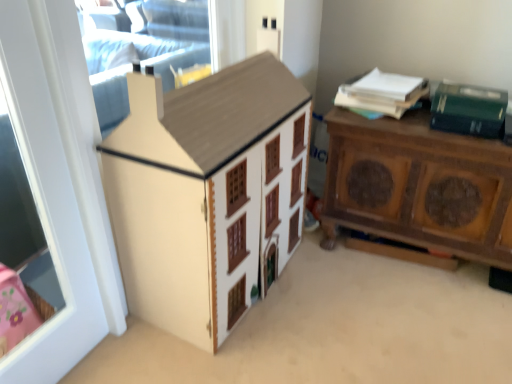
Find the location of a particular element. green matte box at upper right is located at coordinates (468, 110).

You are a GUI agent. You are given a task and a screenshot of the screen. Output one action in this format:
    pyautogui.click(x=<x>, y=<y>)
    Task: Click on the brown wood nightstand at right
    The width and height of the screenshot is (512, 384).
    Given the screenshot: What is the action you would take?
    pyautogui.click(x=419, y=186)

Describe the element at coordinates (207, 193) in the screenshot. The image size is (512, 384). I see `matte wood cabinet at center` at that location.

The height and width of the screenshot is (384, 512). In order to click on green matte box at upper right in this screenshot , I will do `click(468, 110)`.

Considering the relative positions of white paper at upper right and green matte box at upper right in the image provided, is white paper at upper right to the left of green matte box at upper right from the viewer's perspective?

Indeed, white paper at upper right is positioned on the left side of green matte box at upper right.

Between white paper at upper right and green matte box at upper right, which one has less height?

white paper at upper right.

Find the location of a particular element. The width and height of the screenshot is (512, 384). book above the green matte box at upper right (from the image's perspective) is located at coordinates (382, 93).

Is white paper at upper right turned away from green matte box at upper right?

No.

Identify the location of window screen located on the left of white paper at upper right. (28, 165).

Considering the relative positions of white glossy door at left and white paper at upper right in the image provided, is white glossy door at left to the left or to the right of white paper at upper right?

white glossy door at left is to the left of white paper at upper right.

From the image's perspective, is white glossy door at left located above or below white paper at upper right?

Based on their image positions, white glossy door at left is located beneath white paper at upper right.

Who is more distant, matte wood cabinet at center or green matte box at upper right?

green matte box at upper right.

Considering the relative positions of matte wood cabinet at center and green matte box at upper right in the image provided, is matte wood cabinet at center to the left or to the right of green matte box at upper right?

matte wood cabinet at center is to the left of green matte box at upper right.

Is matte wood cabinet at center wider than green matte box at upper right?

Indeed, matte wood cabinet at center has a greater width compared to green matte box at upper right.

How much distance is there between matte wood cabinet at center and green matte box at upper right?

matte wood cabinet at center is 31.20 inches away from green matte box at upper right.

Which of these two, white glossy door at left or green matte box at upper right, stands shorter?

green matte box at upper right.

Between white glossy door at left and green matte box at upper right, which one has larger size?

white glossy door at left is bigger.

From a real-world perspective, is white glossy door at left positioned above or below green matte box at upper right?

Clearly, from a real-world perspective, white glossy door at left is below green matte box at upper right.

Consider the image. Which object is wider, white glossy door at left or green matte box at upper right?

green matte box at upper right is wider.

How many degrees apart are the facing directions of green matte box at upper right and white paper at upper right?

7.75 degrees separate the facing orientations of green matte box at upper right and white paper at upper right.

Identify the location of box in front of the white paper at upper right. (468, 110).

Is green matte box at upper right oriented away from white paper at upper right?

No, white paper at upper right is not at the back of green matte box at upper right.

Between point (493, 128) and point (402, 83), which one is positioned behind?

The point (402, 83) is farther.

Looking at this image, from the image's perspective, between white glossy door at left and brown wood nightstand at right, which one is located above?

brown wood nightstand at right appears higher in the image.

Looking at this image, between white glossy door at left and brown wood nightstand at right, which one appears on the right side from the viewer's perspective?

Positioned to the right is brown wood nightstand at right.

Where is `nightstand above the white glossy door at left (from the image's perspective)`? The image size is (512, 384). nightstand above the white glossy door at left (from the image's perspective) is located at coordinates (419, 186).

In the scene shown: How many degrees apart are the facing directions of white glossy door at left and brown wood nightstand at right?

The angle between the facing direction of white glossy door at left and the facing direction of brown wood nightstand at right is 88.5 degrees.

Does matte wood cabinet at center touch brown wood nightstand at right?

No, matte wood cabinet at center is not beside brown wood nightstand at right.

What's the angular difference between matte wood cabinet at center and brown wood nightstand at right's facing directions?

The angular difference between matte wood cabinet at center and brown wood nightstand at right is 88.5 degrees.

From a real-world perspective, which is physically below, matte wood cabinet at center or brown wood nightstand at right?

brown wood nightstand at right, from a real-world perspective.

Identify the location of cabinetry that appears above the brown wood nightstand at right (from a real-world perspective). (207, 193).

Where is `book behind the green matte box at upper right`? The image size is (512, 384). book behind the green matte box at upper right is located at coordinates (382, 93).

Where is `book on the right of white glossy door at left`? Image resolution: width=512 pixels, height=384 pixels. book on the right of white glossy door at left is located at coordinates (382, 93).

From the image, which object appears to be nearer to green matte box at upper right, white paper at upper right or white glossy door at left?

The object closer to green matte box at upper right is white paper at upper right.

Which object lies nearer to the anchor point brown wood nightstand at right, white paper at upper right or green matte box at upper right?

green matte box at upper right lies closer to brown wood nightstand at right than the other object.

Based on their spatial positions, is matte wood cabinet at center or green matte box at upper right closer to white glossy door at left?

Among the two, matte wood cabinet at center is located nearer to white glossy door at left.

Estimate the real-world distances between objects in this image. Which object is further from white paper at upper right, white glossy door at left or matte wood cabinet at center?

Among the two, white glossy door at left is located further to white paper at upper right.

Estimate the real-world distances between objects in this image. Which object is further from white glossy door at left, matte wood cabinet at center or white paper at upper right?

The object further to white glossy door at left is white paper at upper right.

Based on their spatial positions, is white paper at upper right or brown wood nightstand at right further from matte wood cabinet at center?

Among the two, white paper at upper right is located further to matte wood cabinet at center.

Looking at this image, looking at the image, which one is located closer to matte wood cabinet at center, brown wood nightstand at right or green matte box at upper right?

brown wood nightstand at right lies closer to matte wood cabinet at center than the other object.

Considering their positions, is white glossy door at left positioned closer to matte wood cabinet at center than green matte box at upper right?

The object closer to matte wood cabinet at center is white glossy door at left.

This screenshot has height=384, width=512. I want to click on book located between matte wood cabinet at center and brown wood nightstand at right in the left-right direction, so click(x=382, y=93).

The height and width of the screenshot is (384, 512). In order to click on cabinetry between white glossy door at left and brown wood nightstand at right in the horizontal direction in this screenshot , I will do `click(207, 193)`.

This screenshot has height=384, width=512. I want to click on nightstand situated between matte wood cabinet at center and green matte box at upper right from left to right, so click(x=419, y=186).

This screenshot has height=384, width=512. Identify the location of book between white glossy door at left and green matte box at upper right. [382, 93].